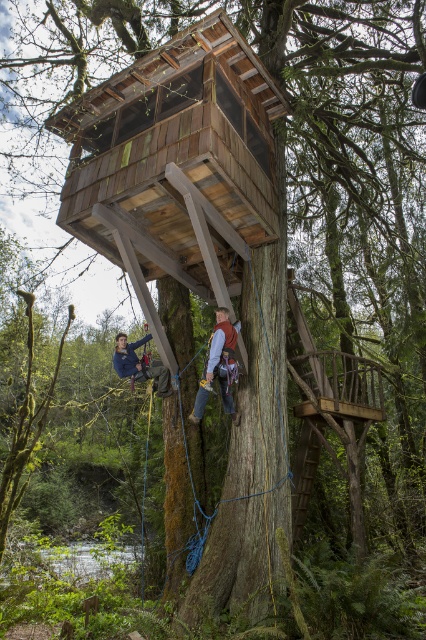
Consider the image. Which is more to the left, brown leather harness at center or blue denim jacket at center?

blue denim jacket at center is more to the left.

Can you confirm if brown leather harness at center is wider than blue denim jacket at center?

No, brown leather harness at center is not wider than blue denim jacket at center.

Between point (233, 410) and point (144, 337), which one is positioned in front?

Positioned in front is point (233, 410).

Locate an element on the screen. This screenshot has height=640, width=426. brown leather harness at center is located at coordinates (218, 365).